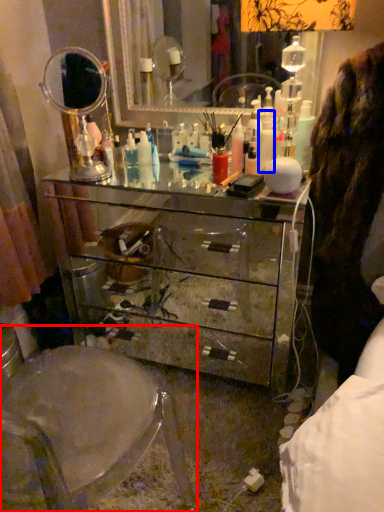
Question: Which point is closer to the camera, swivel chair (highlighted by a red box) or toiletry (highlighted by a blue box)?

Choices:
 (A) swivel chair
 (B) toiletry

Answer: (A)